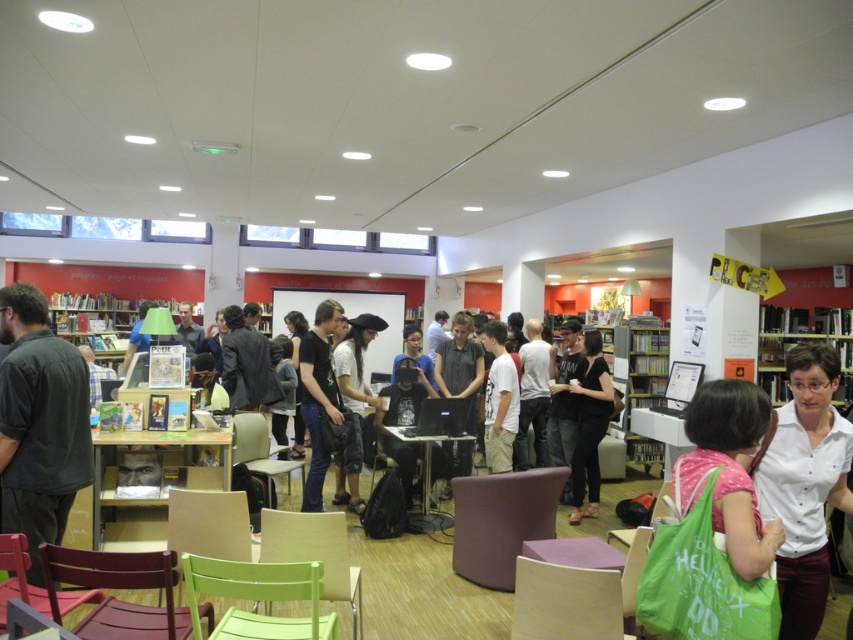
What do you see at coordinates (804, 483) in the screenshot? I see `white matte shirt at center` at bounding box center [804, 483].

In the scene shown: Who is more forward, [840,497] or [485,406]?

Positioned in front is point [840,497].

At what (x,y) coordinates should I click in order to perform the action: click on white matte shirt at center. Please return your answer as a coordinate pair (x, y). This screenshot has width=853, height=640. Looking at the image, I should click on (804, 483).

Which of these two, pink fabric bag at lower right or black matte shirt at center, stands shorter?

With less height is pink fabric bag at lower right.

Does pink fabric bag at lower right come behind black matte shirt at center?

No, it is in front of black matte shirt at center.

Identify the location of pink fabric bag at lower right. The width and height of the screenshot is (853, 640). (729, 468).

The image size is (853, 640). Find the location of `pink fabric bag at lower right`. pink fabric bag at lower right is located at coordinates (729, 468).

Between point (300, 353) and point (492, 403), which one is positioned in front?

Positioned in front is point (300, 353).

Is black cotton t-shirt at center thinner than white cotton shirt at center?

Incorrect, black cotton t-shirt at center's width is not less than white cotton shirt at center's.

The width and height of the screenshot is (853, 640). What do you see at coordinates (318, 397) in the screenshot? I see `black cotton t-shirt at center` at bounding box center [318, 397].

Where is `black cotton t-shirt at center`? This screenshot has width=853, height=640. black cotton t-shirt at center is located at coordinates pos(318,397).